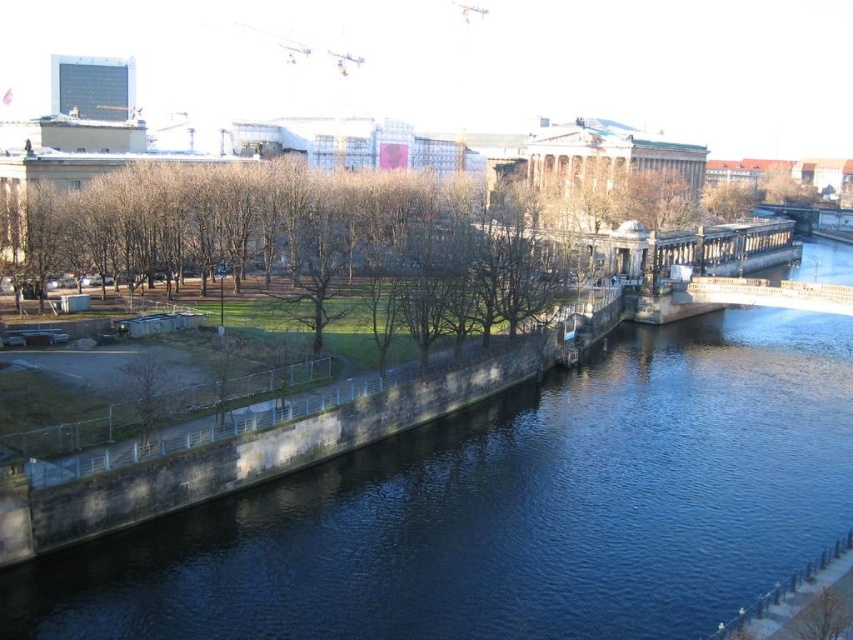
How far apart are blue stone river at center and stone bridge at center?

blue stone river at center and stone bridge at center are 110.51 feet apart from each other.

Can you confirm if blue stone river at center is wider than stone bridge at center?

No, blue stone river at center is not wider than stone bridge at center.

Image resolution: width=853 pixels, height=640 pixels. What do you see at coordinates (509, 509) in the screenshot?
I see `blue stone river at center` at bounding box center [509, 509].

Find the location of `blue stone river at center`. blue stone river at center is located at coordinates (509, 509).